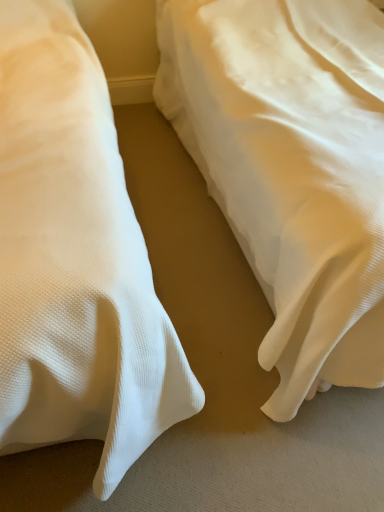
Question: From the image's perspective, is white textured bed at right, marked as the first bed in a left-to-right arrangement, located above or below white textured bed at center, acting as the second bed starting from the left?

Choices:
 (A) below
 (B) above

Answer: (A)

Question: Based on their sizes in the image, would you say white textured bed at right, marked as the first bed in a left-to-right arrangement, is bigger or smaller than white textured bed at center, the first bed when ordered from right to left?

Choices:
 (A) small
 (B) big

Answer: (A)

Question: Is white textured bed at right, positioned as the 2th bed in right-to-left order, in front of or behind white textured bed at center, acting as the second bed starting from the left, in the image?

Choices:
 (A) front
 (B) behind

Answer: (A)

Question: Relative to white textured bed at right, positioned as the 2th bed in right-to-left order, is white textured bed at center, the first bed when ordered from right to left, in front or behind?

Choices:
 (A) behind
 (B) front

Answer: (A)

Question: From a real-world perspective, relative to white textured bed at right, marked as the first bed in a left-to-right arrangement, is white textured bed at center, acting as the second bed starting from the left, vertically above or below?

Choices:
 (A) below
 (B) above

Answer: (A)

Question: In terms of height, does white textured bed at center, acting as the second bed starting from the left, look taller or shorter compared to white textured bed at right, positioned as the 2th bed in right-to-left order?

Choices:
 (A) tall
 (B) short

Answer: (B)

Question: Is white textured bed at center, the first bed when ordered from right to left, wider or thinner than white textured bed at right, positioned as the 2th bed in right-to-left order?

Choices:
 (A) thin
 (B) wide

Answer: (A)